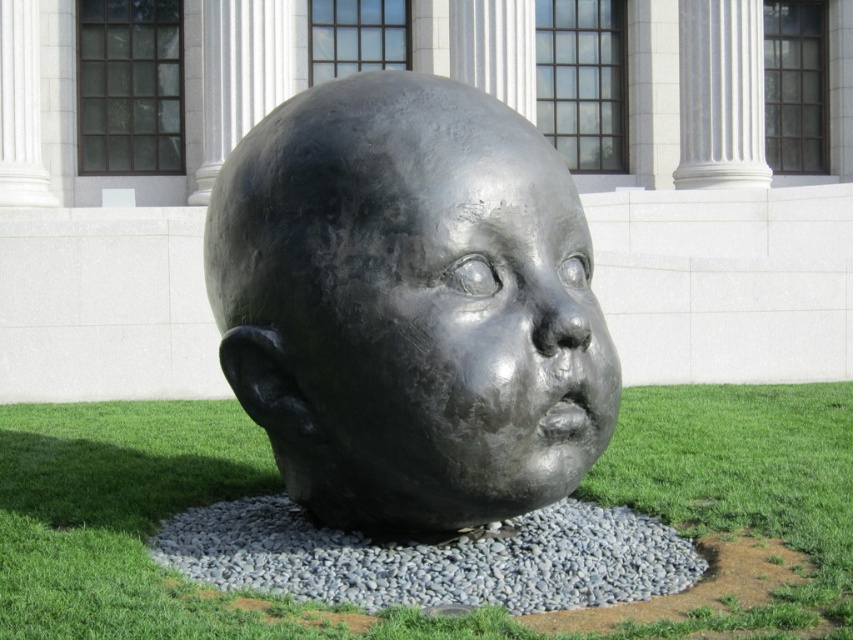
Looking at this image, you are standing in front of the sculpture and want to place a small decorative rock on the ground. You have two options for placement areas near the sculpture base. One area is the green grass at center and the other is the gray gravel at center. Which area is closer to you where you can easily reach without moving your feet?

The green grass at center is closer to the viewer than the gray gravel at center, so you can easily reach it without moving your feet.

You are an artist planning to place a new sculpture between the gray gravel at center and the white marble column at upper center. Which object should you consider for placement to ensure the sculpture fits horizontally?

The gray gravel at center might be wider than the white marble column at upper center, so placing the sculpture near the gray gravel at center would provide more horizontal space.

You are standing in front of the sculpture and see two points marked on the ground. The first point is at coordinate point (192, 458) and the second is at point (399, 257). Which point is closer to you?

Point (399, 257) is closer to you because it is in front of point (192, 458).